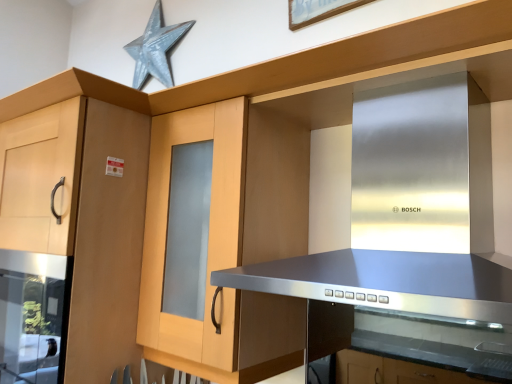
Identify the location of light wood cabinet at left. The width and height of the screenshot is (512, 384). (90, 211).

Find the location of a particular element. stainless steel vent at center is located at coordinates (409, 210).

Where is `light wood cabinet at left`? The image size is (512, 384). light wood cabinet at left is located at coordinates (90, 211).

From a real-world perspective, who is located higher, light wood cabinet at left or metallic silver star at upper center?

metallic silver star at upper center, from a real-world perspective.

Is point (109, 309) closer to viewer compared to point (188, 30)?

Yes.

In the scene shown: Is light wood cabinet at left bigger than metallic silver star at upper center?

Yes, light wood cabinet at left is bigger than metallic silver star at upper center.

Who is more distant, stainless steel vent at center or metallic silver star at upper center?

metallic silver star at upper center is more distant.

Is stainless steel vent at center oriented away from metallic silver star at upper center?

No.

Is point (380, 242) farther from camera compared to point (166, 44)?

No, it is in front of (166, 44).

From the image's perspective, which object appears higher, stainless steel vent at center or metallic silver star at upper center?

metallic silver star at upper center is shown above in the image.

This screenshot has height=384, width=512. Identify the location of star above the stainless steel vent at center (from a real-world perspective). (155, 49).

Which is nearer, (158, 66) or (422, 186)?

Point (158, 66) appears to be farther away from the viewer than point (422, 186).

Is metallic silver star at upper center positioned behind stainless steel vent at center?

Yes, it is behind stainless steel vent at center.

Is metallic silver star at upper center positioned beyond the bounds of stainless steel vent at center?

Yes, metallic silver star at upper center is located beyond the bounds of stainless steel vent at center.

What's the angular difference between metallic silver star at upper center and light wood cabinet at left's facing directions?

They differ by 0.000305 degrees in their facing directions.

Does metallic silver star at upper center appear on the left side of light wood cabinet at left?

No, metallic silver star at upper center is not to the left of light wood cabinet at left.

Who is bigger, metallic silver star at upper center or light wood cabinet at left?

light wood cabinet at left is bigger.

Is metallic silver star at upper center turned away from light wood cabinet at left?

That's not correct — metallic silver star at upper center is not looking away from light wood cabinet at left.

How many degrees apart are the facing directions of light wood cabinet at left and stainless steel vent at center?

The angle between the facing direction of light wood cabinet at left and the facing direction of stainless steel vent at center is 6.46e-05 degrees.

Consider the image. From the image's perspective, would you say light wood cabinet at left is positioned over stainless steel vent at center?

Actually, light wood cabinet at left appears below stainless steel vent at center in the image.

Which object is closer to the camera taking this photo, light wood cabinet at left or stainless steel vent at center?

stainless steel vent at center is in front.

Which object is positioned more to the right, light wood cabinet at left or stainless steel vent at center?

From the viewer's perspective, stainless steel vent at center appears more on the right side.

Is point (447, 157) behind point (95, 359)?

No.

This screenshot has width=512, height=384. Find the location of `vent that is above the light wood cabinet at left (from a real-world perspective)`. vent that is above the light wood cabinet at left (from a real-world perspective) is located at coordinates (409, 210).

Is stainless steel vent at center bigger or smaller than light wood cabinet at left?

In the image, stainless steel vent at center appears to be smaller than light wood cabinet at left.

Does stainless steel vent at center have a lesser width compared to light wood cabinet at left?

Indeed, stainless steel vent at center has a lesser width compared to light wood cabinet at left.

What are the coordinates of `star that appears on the right of light wood cabinet at left` in the screenshot? It's located at coord(155,49).

Where is `star lying behind the stainless steel vent at center`? Image resolution: width=512 pixels, height=384 pixels. star lying behind the stainless steel vent at center is located at coordinates (155, 49).

Based on the photo, from the image, which object appears to be farther from stainless steel vent at center, metallic silver star at upper center or light wood cabinet at left?

metallic silver star at upper center is positioned further to the anchor stainless steel vent at center.

Which object lies further to the anchor point light wood cabinet at left, metallic silver star at upper center or stainless steel vent at center?

metallic silver star at upper center is positioned further to the anchor light wood cabinet at left.

Based on their spatial positions, is light wood cabinet at left or stainless steel vent at center further from metallic silver star at upper center?

Among the two, stainless steel vent at center is located further to metallic silver star at upper center.

When comparing their distances from stainless steel vent at center, does light wood cabinet at left or metallic silver star at upper center seem closer?

Among the two, light wood cabinet at left is located nearer to stainless steel vent at center.

Which object lies further to the anchor point metallic silver star at upper center, stainless steel vent at center or light wood cabinet at left?

Among the two, stainless steel vent at center is located further to metallic silver star at upper center.

In the scene shown: Looking at the image, which one is located closer to light wood cabinet at left, stainless steel vent at center or metallic silver star at upper center?

stainless steel vent at center is closer to light wood cabinet at left.

The image size is (512, 384). Find the location of `cabinetry between stainless steel vent at center and metallic silver star at upper center in the front-back direction`. cabinetry between stainless steel vent at center and metallic silver star at upper center in the front-back direction is located at coordinates (90, 211).